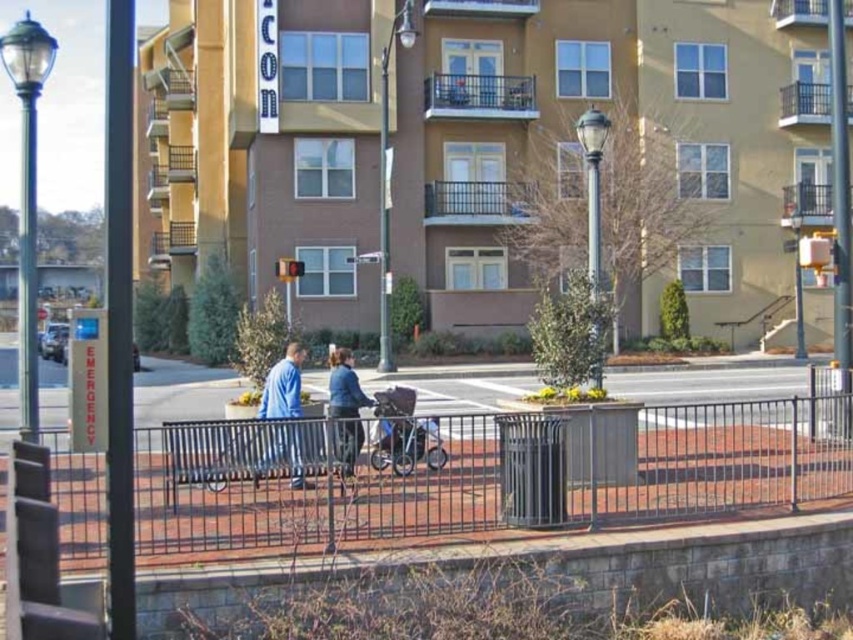
You are standing on the sidewalk in front of the apartment building. You see the green glass lamp post at left and the black metal streetlight at center. Which one is closer to you?

The green glass lamp post at left is closer to the viewer than the black metal streetlight at center.

You are standing at the point with coordinates (489, 474) in the urban residential area. What object are you standing on?

The point with coordinates (489, 474) is on the metallic gray fence at center.

You are a delivery person trying to pass through the narrow path between the metallic gray fence at center and the blue fabric jacket at center. The path is only 1 meter wide. Can you fit through if your delivery cart is 0.8 meters wide?

The metallic gray fence at center might be wider than the blue fabric jacket at center, but the exact width isn not specified. However, since the path is 1 meter wide and your cart is 0.8 meters wide, there is enough space for the cart to pass through as long as the total width of the objects doesn not exceed the path width. Without precise measurements, it is uncertain, but the available space suggests it could be possible.